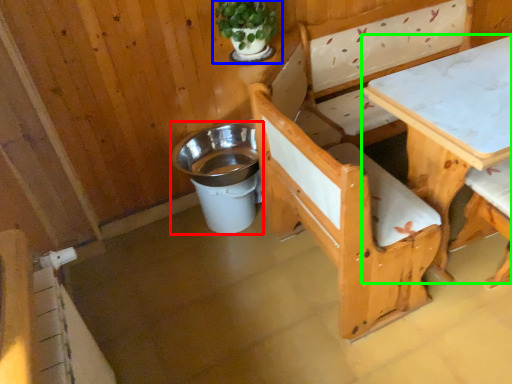
Question: Which object is positioned farthest from trash bin/can (highlighted by a red box)? Select from houseplant (highlighted by a blue box) and table (highlighted by a green box).

Choices:
 (A) houseplant
 (B) table

Answer: (B)